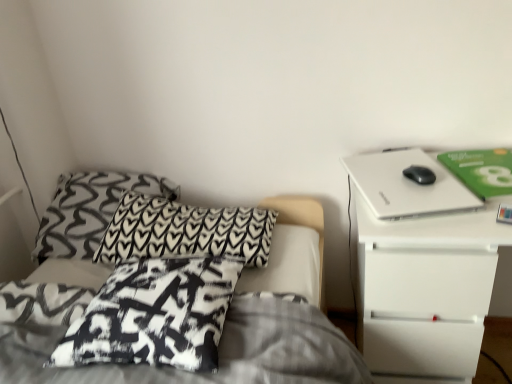
Where is `white matte laptop at upper right`? white matte laptop at upper right is located at coordinates (406, 184).

The image size is (512, 384). I want to click on green matte paperback book at upper right, so click(481, 170).

This screenshot has height=384, width=512. Describe the element at coordinates (155, 315) in the screenshot. I see `black printed pillow at center, which appears as the 3th pillow when viewed from the back` at that location.

The width and height of the screenshot is (512, 384). Find the location of `black printed fabric pillow at upper left, which ranks as the second pillow in back-to-front order`. black printed fabric pillow at upper left, which ranks as the second pillow in back-to-front order is located at coordinates (185, 231).

What is the approximate height of black matte mouse at right?

black matte mouse at right is 1.15 inches tall.

What are the coordinates of `white matte laptop at upper right` in the screenshot? It's located at (406, 184).

Is black printed fabric pillow at upper left, acting as the 2th pillow starting from the front, taller or shorter than black printed pillow at center, arranged as the 1th pillow when viewed from the front?

black printed fabric pillow at upper left, acting as the 2th pillow starting from the front, is taller than black printed pillow at center, arranged as the 1th pillow when viewed from the front.

Is black printed fabric pillow at upper left, which ranks as the second pillow in back-to-front order, beside black printed pillow at center, which appears as the 3th pillow when viewed from the back?

They are not placed beside each other.

Is black printed fabric pillow at upper left, acting as the 2th pillow starting from the front, bigger or smaller than black printed pillow at center, which appears as the 3th pillow when viewed from the back?

Considering their sizes, black printed fabric pillow at upper left, acting as the 2th pillow starting from the front, takes up more space than black printed pillow at center, which appears as the 3th pillow when viewed from the back.

Which is behind, point (216, 293) or point (77, 185)?

The point (77, 185) is farther.

Find the location of a particular element. the 2nd pillow positioned below the black printed pillow at upper left, the 1th pillow viewed from the back (from the image's perspective) is located at coordinates (155, 315).

Considering the sizes of objects black printed pillow at center, arranged as the 1th pillow when viewed from the front, and black printed pillow at upper left, the 3th pillow in the front-to-back sequence, in the image provided, who is wider, black printed pillow at center, arranged as the 1th pillow when viewed from the front, or black printed pillow at upper left, the 3th pillow in the front-to-back sequence,?

Wider between the two is black printed pillow at upper left, the 3th pillow in the front-to-back sequence.

From the picture: Can black printed pillow at upper left, the 1th pillow viewed from the back, be found inside black printed pillow at center, which appears as the 3th pillow when viewed from the back?

No, black printed pillow at upper left, the 1th pillow viewed from the back, is located outside of black printed pillow at center, which appears as the 3th pillow when viewed from the back.

How many degrees apart are the facing directions of black printed fabric pillow at upper left, which ranks as the second pillow in back-to-front order, and black matte mouse at right?

black printed fabric pillow at upper left, which ranks as the second pillow in back-to-front order, and black matte mouse at right are facing 63.7 degrees away from each other.

How much distance is there between black printed fabric pillow at upper left, acting as the 2th pillow starting from the front, and black matte mouse at right?

The distance of black printed fabric pillow at upper left, acting as the 2th pillow starting from the front, from black matte mouse at right is 68.53 centimeters.

Considering the relative sizes of black printed fabric pillow at upper left, acting as the 2th pillow starting from the front, and black matte mouse at right in the image provided, is black printed fabric pillow at upper left, acting as the 2th pillow starting from the front, thinner than black matte mouse at right?

No, black printed fabric pillow at upper left, acting as the 2th pillow starting from the front, is not thinner than black matte mouse at right.

Is black printed fabric pillow at upper left, acting as the 2th pillow starting from the front, touching black matte mouse at right?

There is a gap between black printed fabric pillow at upper left, acting as the 2th pillow starting from the front, and black matte mouse at right.

How different are the orientations of green matte paperback book at upper right and black printed pillow at center, which appears as the 3th pillow when viewed from the back, in degrees?

The angle between the facing direction of green matte paperback book at upper right and the facing direction of black printed pillow at center, which appears as the 3th pillow when viewed from the back, is 76.5 degrees.

Does point (457, 162) appear closer or farther from the camera than point (71, 335)?

Point (457, 162) is positioned farther from the camera compared to point (71, 335).

Consider the image. In terms of height, does green matte paperback book at upper right look taller or shorter compared to black printed pillow at center, which appears as the 3th pillow when viewed from the back?

Clearly, green matte paperback book at upper right is shorter compared to black printed pillow at center, which appears as the 3th pillow when viewed from the back.

Based on the photo, which is more to the left, green matte paperback book at upper right or black printed pillow at center, which appears as the 3th pillow when viewed from the back?

black printed pillow at center, which appears as the 3th pillow when viewed from the back.

Does point (88, 241) appear closer or farther from the camera than point (504, 149)?

Point (88, 241) is farther from the camera than point (504, 149).

Is there a large distance between black printed pillow at upper left, the 1th pillow viewed from the back, and green matte paperback book at upper right?

That's right, there is a large distance between black printed pillow at upper left, the 1th pillow viewed from the back, and green matte paperback book at upper right.

What's the angular difference between black printed pillow at upper left, the 1th pillow viewed from the back, and green matte paperback book at upper right's facing directions?

The angle between the facing direction of black printed pillow at upper left, the 1th pillow viewed from the back, and the facing direction of green matte paperback book at upper right is 78.9 degrees.

From the image's perspective, is black printed pillow at upper left, the 1th pillow viewed from the back, beneath green matte paperback book at upper right?

Yes.

How far apart are white matte nightstand at right and black printed fabric pillow at upper left, acting as the 2th pillow starting from the front?

white matte nightstand at right and black printed fabric pillow at upper left, acting as the 2th pillow starting from the front, are 50.32 centimeters apart from each other.

How many degrees apart are the facing directions of white matte nightstand at right and black printed fabric pillow at upper left, which ranks as the second pillow in back-to-front order?

The angular difference between white matte nightstand at right and black printed fabric pillow at upper left, which ranks as the second pillow in back-to-front order, is 92.4 degrees.

Who is taller, white matte nightstand at right or black printed fabric pillow at upper left, acting as the 2th pillow starting from the front?

white matte nightstand at right.

In the scene shown: Is black printed fabric pillow at upper left, which ranks as the second pillow in back-to-front order, inside white matte nightstand at right?

No, black printed fabric pillow at upper left, which ranks as the second pillow in back-to-front order, is located outside of white matte nightstand at right.

Which of these two, black printed pillow at center, arranged as the 1th pillow when viewed from the front, or white matte nightstand at right, is wider?

With larger width is white matte nightstand at right.

Considering the relative sizes of black printed pillow at center, which appears as the 3th pillow when viewed from the back, and white matte nightstand at right in the image provided, is black printed pillow at center, which appears as the 3th pillow when viewed from the back, taller than white matte nightstand at right?

Incorrect, the height of black printed pillow at center, which appears as the 3th pillow when viewed from the back, is not larger of that of white matte nightstand at right.

Measure the distance between black printed pillow at center, which appears as the 3th pillow when viewed from the back, and white matte nightstand at right.

black printed pillow at center, which appears as the 3th pillow when viewed from the back, is 20.23 inches from white matte nightstand at right.

Find the location of a particular element. This screenshot has width=512, height=384. pillow below the black printed fabric pillow at upper left, which ranks as the second pillow in back-to-front order (from the image's perspective) is located at coordinates (155, 315).

There is a black printed pillow at upper left, the 3th pillow in the front-to-back sequence. Where is `the 1st pillow below it (from a real-world perspective)`? The image size is (512, 384). the 1st pillow below it (from a real-world perspective) is located at coordinates (155, 315).

Considering their positions, is white matte nightstand at right positioned further to black printed pillow at upper left, the 3th pillow in the front-to-back sequence, than white matte laptop at upper right?

The object further to black printed pillow at upper left, the 3th pillow in the front-to-back sequence, is white matte nightstand at right.

When comparing their distances from black matte mouse at right, does black printed fabric pillow at upper left, acting as the 2th pillow starting from the front, or black printed pillow at upper left, the 1th pillow viewed from the back, seem closer?

The object closer to black matte mouse at right is black printed fabric pillow at upper left, acting as the 2th pillow starting from the front.

From the picture: Estimate the real-world distances between objects in this image. Which object is further from black matte mouse at right, white matte nightstand at right or black printed pillow at upper left, the 3th pillow in the front-to-back sequence?

black printed pillow at upper left, the 3th pillow in the front-to-back sequence, is positioned further to the anchor black matte mouse at right.

Considering their positions, is black matte mouse at right positioned further to black printed pillow at upper left, the 1th pillow viewed from the back, than white matte laptop at upper right?

black matte mouse at right is further to black printed pillow at upper left, the 1th pillow viewed from the back.

From the image, which object appears to be farther from black printed pillow at center, arranged as the 1th pillow when viewed from the front, white matte nightstand at right or white matte laptop at upper right?

white matte laptop at upper right.

From the image, which object appears to be farther from black printed pillow at center, which appears as the 3th pillow when viewed from the back, black printed fabric pillow at upper left, acting as the 2th pillow starting from the front, or black printed pillow at upper left, the 3th pillow in the front-to-back sequence?

Based on the image, black printed pillow at upper left, the 3th pillow in the front-to-back sequence, appears to be further to black printed pillow at center, which appears as the 3th pillow when viewed from the back.

Considering their positions, is green matte paperback book at upper right positioned closer to black printed pillow at upper left, the 3th pillow in the front-to-back sequence, than black matte mouse at right?

black matte mouse at right lies closer to black printed pillow at upper left, the 3th pillow in the front-to-back sequence, than the other object.

From the image, which object appears to be nearer to black printed pillow at center, arranged as the 1th pillow when viewed from the front, white matte laptop at upper right or black matte mouse at right?

white matte laptop at upper right.

Image resolution: width=512 pixels, height=384 pixels. Find the location of `mouse between white matte laptop at upper right and green matte paperback book at upper right`. mouse between white matte laptop at upper right and green matte paperback book at upper right is located at coordinates (420, 174).

The height and width of the screenshot is (384, 512). In order to click on pillow between black printed pillow at center, which appears as the 3th pillow when viewed from the back, and black matte mouse at right in this screenshot , I will do `click(185, 231)`.

This screenshot has width=512, height=384. What are the coordinates of `computer between black printed fabric pillow at upper left, acting as the 2th pillow starting from the front, and green matte paperback book at upper right, in the horizontal direction` in the screenshot? It's located at (406, 184).

Locate an element on the screen. This screenshot has height=384, width=512. computer between black matte mouse at right and white matte nightstand at right in the up-down direction is located at coordinates (406, 184).